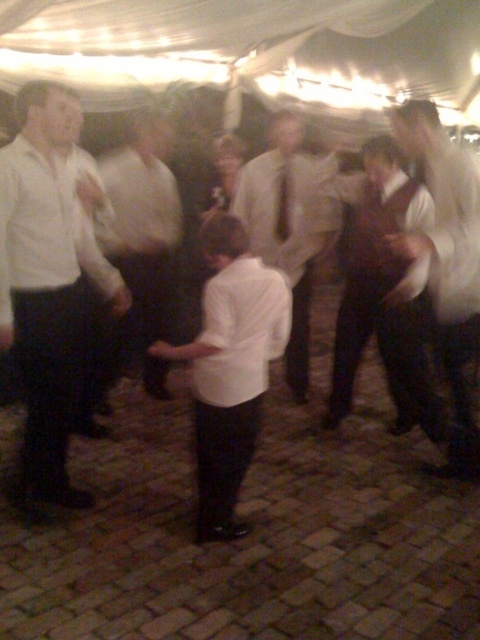
Is light brown textured shirt at center shorter than white shirt at center?

Yes, light brown textured shirt at center is shorter than white shirt at center.

Locate an element on the screen. light brown textured shirt at center is located at coordinates (290, 228).

You are a GUI agent. You are given a task and a screenshot of the screen. Output one action in this format:
    pyautogui.click(x=<x>, y=<y>)
    Task: Click on the light brown textured shirt at center
    
    Given the screenshot: What is the action you would take?
    pyautogui.click(x=290, y=228)

Is point (356, 280) positioned behind point (280, 168)?

No, (356, 280) is in front of (280, 168).

Between matte brown vest at right and matte white tie at center, which one is positioned higher?

Positioned higher is matte white tie at center.

Identify the location of matte brown vest at right. (382, 291).

Which is above, white shirt at right or matte white tie at center?

matte white tie at center

Is white shirt at right above matte white tie at center?

No, white shirt at right is not above matte white tie at center.

Is point (474, 205) behind point (279, 168)?

No, it is in front of (279, 168).

I want to click on white shirt at right, so click(447, 266).